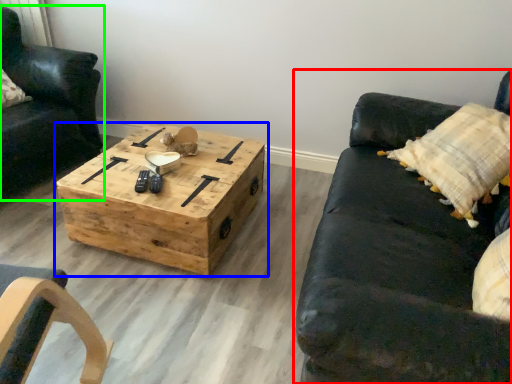
Question: Considering the real-world distances, which object is closest to studio couch (highlighted by a red box)? coffee table (highlighted by a blue box) or chair (highlighted by a green box).

Choices:
 (A) coffee table
 (B) chair

Answer: (A)